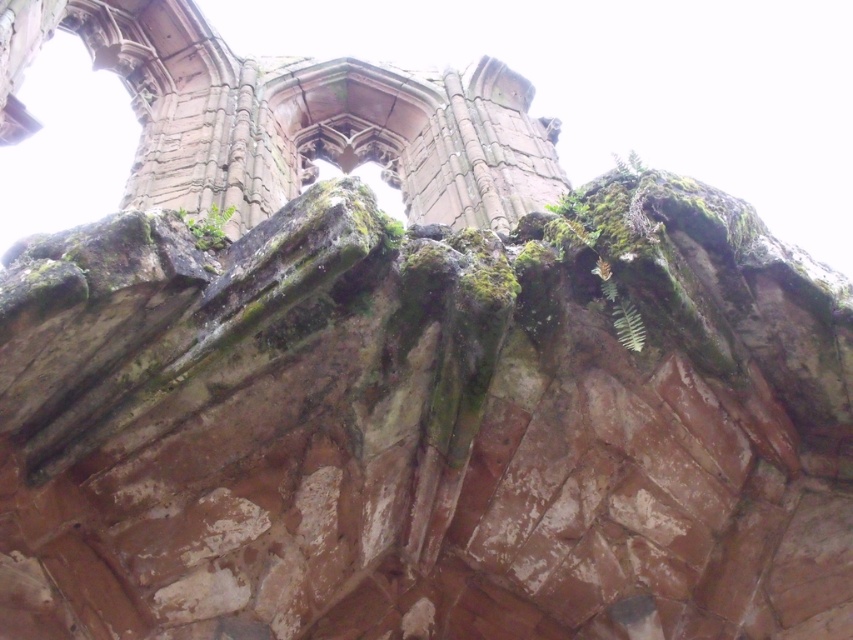
Question: Is green leafy plant at upper center wider than green mossy rock at upper center?

Choices:
 (A) yes
 (B) no

Answer: (B)

Question: Does green leafy plant at upper center have a greater width compared to green mossy rock at upper center?

Choices:
 (A) yes
 (B) no

Answer: (B)

Question: Among these points, which one is farthest from the camera?

Choices:
 (A) (212, 227)
 (B) (621, 323)

Answer: (A)

Question: Considering the relative positions of green leafy plant at upper center and green mossy rock at upper center in the image provided, where is green leafy plant at upper center located with respect to green mossy rock at upper center?

Choices:
 (A) below
 (B) above

Answer: (A)